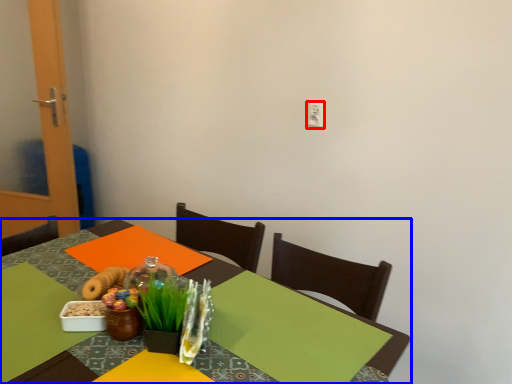
Question: Which object appears closest to the camera in this image, electric outlet (highlighted by a red box) or table (highlighted by a blue box)?

Choices:
 (A) electric outlet
 (B) table

Answer: (B)